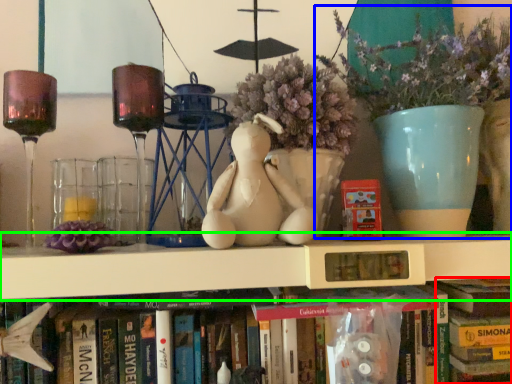
Question: Considering the real-world distances, which object is closest to book (highlighted by a red box)? floral arrangement (highlighted by a blue box) or shelf (highlighted by a green box).

Choices:
 (A) floral arrangement
 (B) shelf

Answer: (B)